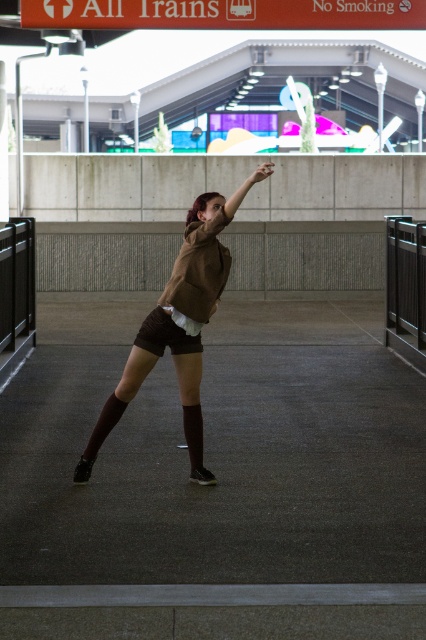
You are an architect designing a new train station. You need to place a large digital screen that will be positioned at point 0.514, 0.420. The screen will display real time train schedules. Where should you place the screen so that it is visible to someone wearing the brown suede hoodie at center?

The screen should be placed at the same location as the brown suede hoodie at center, which is at point (178, 328), so the person wearing it can easily view the real time train schedules displayed on the screen.

You are a photographer trying to capture the person in the scene. You notice the brown suede shorts at center and the matte brown sweater at center. Which clothing item will appear larger in your photo if you focus on the person?

The brown suede shorts at center will appear larger in the photo because it is in front of the matte brown sweater at center, making it closer to the camera.